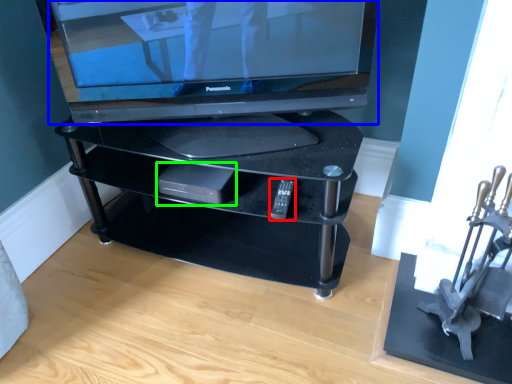
Question: Estimate the real-world distances between objects in this image. Which object is closer to remote (highlighted by a red box), television (highlighted by a blue box) or gadget (highlighted by a green box)?

Choices:
 (A) television
 (B) gadget

Answer: (B)